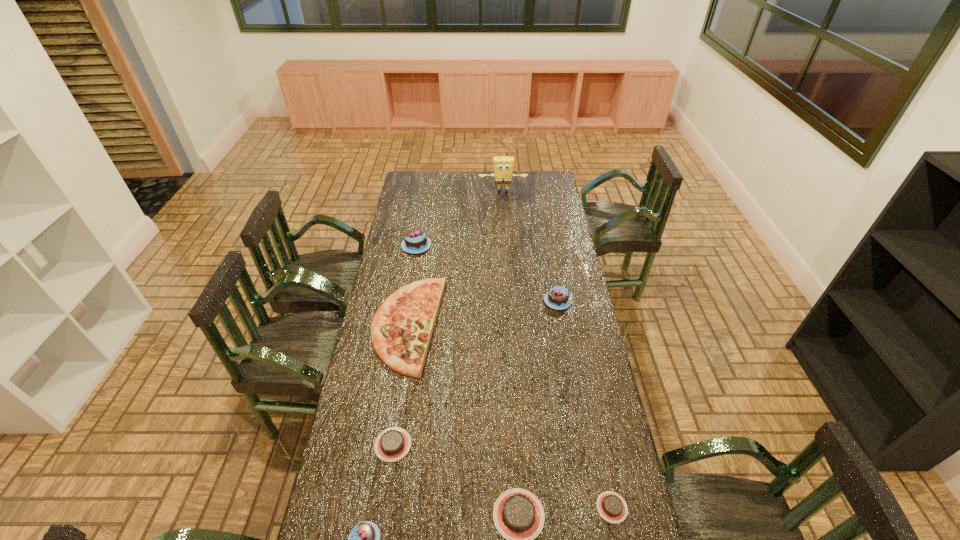
Identify which object is the closest to the second nearest pink chocolate cake. Please provide its 2D coordinates. Your answer should be formatted as a tuple, i.e. [(x, y)], where the tuple contains the x and y coordinates of a point satisfying the conditions above.

[(401, 330)]

Locate which chocolate cake is the fifth closest to the fifth tallest chocolate cake. Please provide its 2D coordinates. Your answer should be formatted as a tuple, i.e. [(x, y)], where the tuple contains the x and y coordinates of a point satisfying the conditions above.

[(415, 241)]

Locate an element on the screen. The height and width of the screenshot is (540, 960). the fourth closest chocolate cake to the third shortest object is located at coordinates (558, 298).

Select which pink chocolate cake appears as the closest to the third shortest object. Please provide its 2D coordinates. Your answer should be formatted as a tuple, i.e. [(x, y)], where the tuple contains the x and y coordinates of a point satisfying the conditions above.

[(364, 539)]

Locate an element on the screen. This screenshot has width=960, height=540. pink chocolate cake that is the closest to the third shortest chocolate cake is located at coordinates (364, 539).

Select which brown chocolate cake is the closest to the biggest brown chocolate cake. Please provide its 2D coordinates. Your answer should be formatted as a tuple, i.e. [(x, y)], where the tuple contains the x and y coordinates of a point satisfying the conditions above.

[(611, 506)]

Locate an element on the screen. Image resolution: width=960 pixels, height=540 pixels. brown chocolate cake identified as the second closest to the smallest pink chocolate cake is located at coordinates (518, 515).

Find the location of `free point that satisfies the following two spatial constraints: 1. on the back side of the second farthest chocolate cake; 2. on the right side of the pizza`. free point that satisfies the following two spatial constraints: 1. on the back side of the second farthest chocolate cake; 2. on the right side of the pizza is located at coordinates (412, 301).

Image resolution: width=960 pixels, height=540 pixels. I want to click on vacant space that satisfies the following two spatial constraints: 1. on the back side of the pizza; 2. on the left side of the fifth nearest chocolate cake, so click(412, 301).